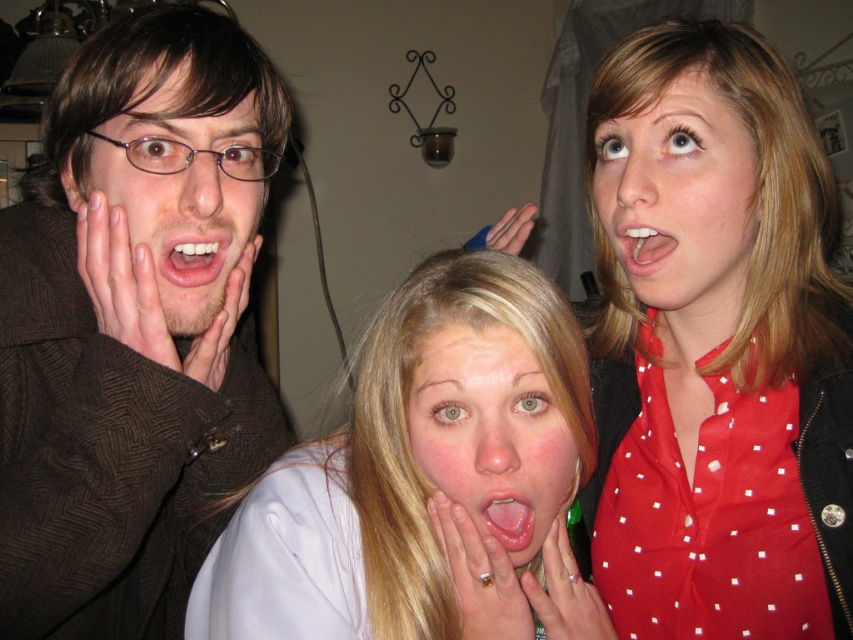
Based on the coordinates provided in the scene description, where is the pale skin face at center located?

The pale skin face at center is located at point coordinates of (490, 435).

You are a photographer standing 2 meters away from the three people in the image. You want to take a photo of the brown textured jacket at left and the matte blue hand at center without any obstruction. Is the distance between them sufficient for you to capture both in a single frame if your camera has a 1.5 meter focal length range?

The distance between the brown textured jacket at left and matte blue hand at center is 1.06 meters, which is within the camera focal length range of 1.5 meters. Therefore, you can capture both in a single frame.